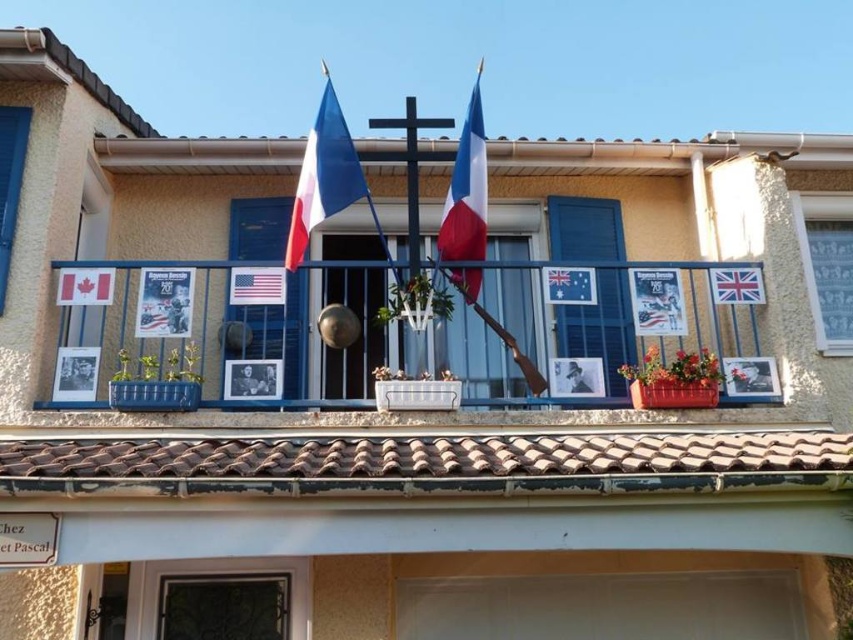
Question: Among these objects, which one is farthest from the camera?

Choices:
 (A) matte red flag at left
 (B) blue fabric curtain at upper right
 (C) blue fabric flag at center
 (D) blue plastic shutter at upper left

Answer: (B)

Question: Does metallic blue railing at center lie behind blue matte shutter at center?

Choices:
 (A) yes
 (B) no

Answer: (B)

Question: Estimate the real-world distances between objects in this image. Which object is farther from the matte fabric flag at upper center?

Choices:
 (A) blue fabric flag at center
 (B) metallic blue railing at center
 (C) american flag at center
 (D) blue fabric curtain at upper right

Answer: (D)

Question: Is metallic blue railing at center in front of blue painted wood shutter at center?

Choices:
 (A) yes
 (B) no

Answer: (A)

Question: Considering the real-world distances, which object is closest to the matte red flag at left?

Choices:
 (A) blue painted wood shutter at center
 (B) american flag at center
 (C) matte fabric flag at upper center
 (D) blue plastic shutter at upper left

Answer: (D)

Question: Is blue painted wood shutter at center to the right of gold metallic bell at center from the viewer's perspective?

Choices:
 (A) no
 (B) yes

Answer: (B)